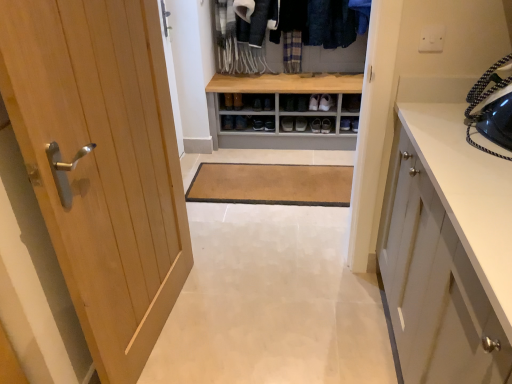
Measure the distance between point (329, 40) and camera.

The distance of point (329, 40) from camera is 3.16 meters.

What do you see at coordinates (287, 123) in the screenshot?
I see `matte black shoe at center, the 1th footwear viewed from the left` at bounding box center [287, 123].

What is the approximate height of matte black shoe at center, acting as the first shoe starting from the bottom?

matte black shoe at center, acting as the first shoe starting from the bottom, is 4.21 inches in height.

Image resolution: width=512 pixels, height=384 pixels. Find the location of `matte gray shelf at center`. matte gray shelf at center is located at coordinates (351, 103).

Measure the distance between brown leather shoe at center, positioned as the first shoe in top-to-bottom order, and camera.

The depth of brown leather shoe at center, positioned as the first shoe in top-to-bottom order, is 10.78 feet.

The width and height of the screenshot is (512, 384). What do you see at coordinates (432, 39) in the screenshot? I see `white plastic electric outlet at upper center` at bounding box center [432, 39].

Where is `dark blue woolen sweater at upper center`? The height and width of the screenshot is (384, 512). dark blue woolen sweater at upper center is located at coordinates (330, 24).

From a real-world perspective, who is located higher, light wood door at left or matte black shoe at center, which appears as the 3th footwear when viewed from the right?

light wood door at left, from a real-world perspective.

Do you think light wood door at left is within matte black shoe at center, the 1th footwear viewed from the left, or outside of it?

light wood door at left is located beyond the bounds of matte black shoe at center, the 1th footwear viewed from the left.

Can you tell me how much light wood door at left and matte black shoe at center, the 1th footwear viewed from the left, differ in facing direction?

80.8 degrees separate the facing orientations of light wood door at left and matte black shoe at center, the 1th footwear viewed from the left.

Are light wood door at left and matte black shoe at center, the 1th footwear viewed from the left, making contact?

No, light wood door at left is not with matte black shoe at center, the 1th footwear viewed from the left.

Which is behind, matte black shoe at center, the 1th footwear viewed from the left, or light wood door at left?

matte black shoe at center, the 1th footwear viewed from the left.

From the picture: How different are the orientations of matte black shoe at center, the 1th footwear viewed from the left, and light wood door at left in degrees?

They differ by 80.8 degrees in their facing directions.

Considering the positions of objects matte black shoe at center, which appears as the 3th footwear when viewed from the right, and light wood door at left in the image provided, who is more to the left, matte black shoe at center, which appears as the 3th footwear when viewed from the right, or light wood door at left?

Positioned to the left is light wood door at left.

Considering the sizes of objects matte black shoe at center, the 1th footwear viewed from the left, and light wood door at left in the image provided, who is smaller, matte black shoe at center, the 1th footwear viewed from the left, or light wood door at left?

With smaller size is matte black shoe at center, the 1th footwear viewed from the left.

Is light wood door at left facing away from white leather shoe at center, the third footwear from the left?

No, light wood door at left is not facing the opposite direction of white leather shoe at center, the third footwear from the left.

From the picture: Which object is closer to the camera, light wood door at left or white leather shoe at center, which ranks as the 1th footwear in right-to-left order?

light wood door at left is closer to the camera.

Is light wood door at left taller or shorter than white leather shoe at center, which ranks as the 1th footwear in right-to-left order?

In the image, light wood door at left appears to be taller than white leather shoe at center, which ranks as the 1th footwear in right-to-left order.

What's the angular difference between light wood door at left and white leather shoe at center, which ranks as the 1th footwear in right-to-left order,'s facing directions?

They differ by 78.6 degrees in their facing directions.

Based on the photo, from a real-world perspective, which is physically below, dark blue woolen sweater at upper center or matte gray shelf at center?

matte gray shelf at center.

Is dark blue woolen sweater at upper center to the left or to the right of matte gray shelf at center in the image?

In the image, dark blue woolen sweater at upper center appears on the left side of matte gray shelf at center.

Looking at the image, does dark blue woolen sweater at upper center seem bigger or smaller compared to matte gray shelf at center?

Clearly, dark blue woolen sweater at upper center is larger in size than matte gray shelf at center.

How many degrees apart are the facing directions of dark blue woolen sweater at upper center and matte gray shelf at center?

The facing directions of dark blue woolen sweater at upper center and matte gray shelf at center are 8.19 degrees apart.

Locate an element on the screen. This screenshot has height=384, width=512. footwear in front of the matte gray shoe at center, which ranks as the 2th footwear in left-to-right order is located at coordinates (326, 102).

Between point (329, 95) and point (302, 122), which one is positioned behind?

The point (302, 122) is farther.

From the image's perspective, relative to matte gray shoe at center, which ranks as the 2th footwear in left-to-right order, is white leather shoe at center, which ranks as the 1th footwear in right-to-left order, above or below?

Clearly, from the image's perspective, white leather shoe at center, which ranks as the 1th footwear in right-to-left order, is above matte gray shoe at center, which ranks as the 2th footwear in left-to-right order.

From a real-world perspective, who is located lower, white leather shoe at center, which ranks as the 1th footwear in right-to-left order, or matte gray shoe at center, which is counted as the 2th footwear, starting from the right?

matte gray shoe at center, which is counted as the 2th footwear, starting from the right, from a real-world perspective.

Is wooden dresser at center completely or partially outside of white plastic electric outlet at upper center?

Yes.

Is wooden dresser at center bigger than white plastic electric outlet at upper center?

Indeed, wooden dresser at center has a larger size compared to white plastic electric outlet at upper center.

How far apart are wooden dresser at center and white plastic electric outlet at upper center?

The distance of wooden dresser at center from white plastic electric outlet at upper center is 1.83 meters.

Between wooden dresser at center and white plastic electric outlet at upper center, which one is positioned in front?

white plastic electric outlet at upper center.

From a real-world perspective, is matte black shoe at center, marked as the first shoe in a left-to-right arrangement, positioned above or below dark blue woolen sweater at upper center?

matte black shoe at center, marked as the first shoe in a left-to-right arrangement, is below dark blue woolen sweater at upper center.

Is matte black shoe at center, the second shoe from the right, taller than dark blue woolen sweater at upper center?

In fact, matte black shoe at center, the second shoe from the right, may be shorter than dark blue woolen sweater at upper center.

Can you confirm if matte black shoe at center, marked as the first shoe in a left-to-right arrangement, is bigger than dark blue woolen sweater at upper center?

Incorrect, matte black shoe at center, marked as the first shoe in a left-to-right arrangement, is not larger than dark blue woolen sweater at upper center.

Locate an element on the screen. The image size is (512, 384). door that is in front of the matte black shoe at center, which appears as the 3th footwear when viewed from the right is located at coordinates (102, 164).

Where is `door below the matte black shoe at center, the 1th footwear viewed from the left (from the image's perspective)`? door below the matte black shoe at center, the 1th footwear viewed from the left (from the image's perspective) is located at coordinates (102, 164).

Estimate the real-world distances between objects in this image. Which object is closer to matte black shoe at center, the 1th footwear viewed from the left, brown leather shoe at center, the 1th shoe in the right-to-left sequence, or light wood door at left?

brown leather shoe at center, the 1th shoe in the right-to-left sequence, is positioned closer to the anchor matte black shoe at center, the 1th footwear viewed from the left.

Based on their spatial positions, is wooden dresser at center or dark blue woolen sweater at upper center further from matte black shoe at center, acting as the first shoe starting from the bottom?

Among the two, dark blue woolen sweater at upper center is located further to matte black shoe at center, acting as the first shoe starting from the bottom.

When comparing their distances from matte gray shelf at center, does matte black shoe at center, the second shoe from the right, or white glossy cabinet at right seem closer?

matte black shoe at center, the second shoe from the right, lies closer to matte gray shelf at center than the other object.

Based on the photo, which object lies further to the anchor point dark blue woolen sweater at upper center, matte gray shelf at center or white glossy cabinet at right?

white glossy cabinet at right.

Considering their positions, is matte black shoe at center, marked as the first shoe in a left-to-right arrangement, positioned closer to dark blue woolen sweater at upper center than light wood door at left?

Among the two, matte black shoe at center, marked as the first shoe in a left-to-right arrangement, is located nearer to dark blue woolen sweater at upper center.

From the image, which object appears to be farther from matte black shoe at center, which appears as the 3th footwear when viewed from the right, brown leather shoe at center, positioned as the second shoe in left-to-right order, or white leather shoe at center, the third footwear from the left?

brown leather shoe at center, positioned as the second shoe in left-to-right order, is positioned further to the anchor matte black shoe at center, which appears as the 3th footwear when viewed from the right.

Considering their positions, is matte black shoe at center, acting as the first shoe starting from the bottom, positioned closer to matte black shoe at center, the 1th footwear viewed from the left, than light wood door at left?

Among the two, matte black shoe at center, acting as the first shoe starting from the bottom, is located nearer to matte black shoe at center, the 1th footwear viewed from the left.

From the image, which object appears to be farther from matte gray shelf at center, light wood door at left or matte gray shoe at center, which is counted as the 2th footwear, starting from the right?

light wood door at left.

The width and height of the screenshot is (512, 384). Find the location of `shelf between white plastic electric outlet at upper center and matte black shoe at center, which is the second shoe in top-to-bottom order, in the front-back direction`. shelf between white plastic electric outlet at upper center and matte black shoe at center, which is the second shoe in top-to-bottom order, in the front-back direction is located at coordinates (351, 103).

Where is `shelf between white plastic electric outlet at upper center and brown leather shoe at center, positioned as the second shoe in left-to-right order, along the z-axis`? shelf between white plastic electric outlet at upper center and brown leather shoe at center, positioned as the second shoe in left-to-right order, along the z-axis is located at coordinates (351, 103).

Find the location of a particular element. The width and height of the screenshot is (512, 384). electric outlet positioned between light wood door at left and matte black shoe at center, which appears as the 3th footwear when viewed from the right, from near to far is located at coordinates (432, 39).

Where is `shoe located between white glossy cabinet at right and matte black shoe at center, the second shoe from the right, in the depth direction`? shoe located between white glossy cabinet at right and matte black shoe at center, the second shoe from the right, in the depth direction is located at coordinates (237, 101).